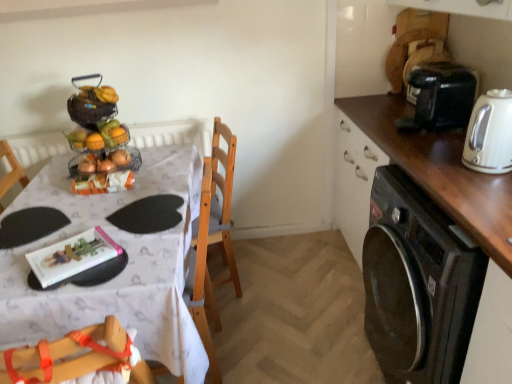
At what (x,y) coordinates should I click in order to perform the action: click on vacant point to the right of white paper at left. Please return your answer as a coordinate pair (x, y). Image resolution: width=512 pixels, height=384 pixels. Looking at the image, I should click on (152, 252).